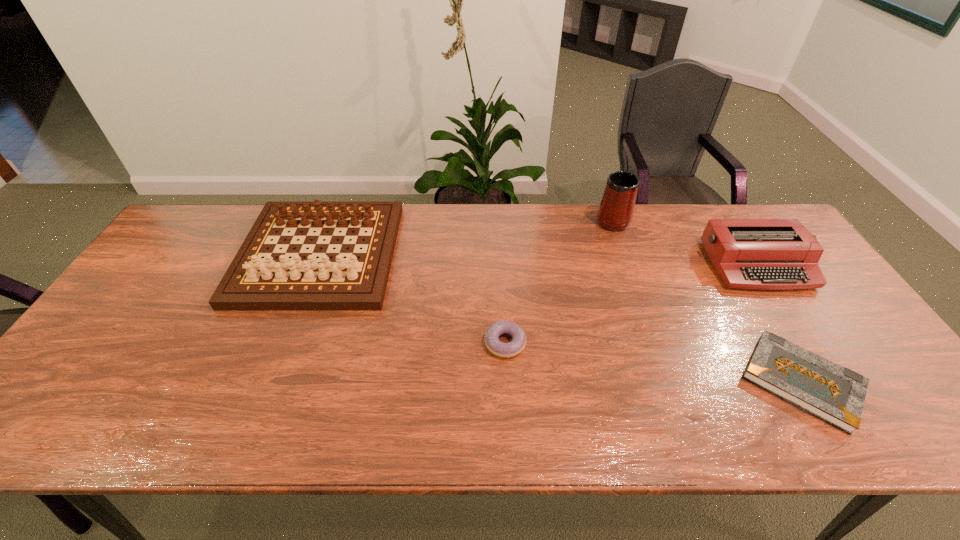
Where is `mug located at the far edge`? The image size is (960, 540). mug located at the far edge is located at coordinates (615, 212).

What are the coordinates of `gameboard present at the far edge` in the screenshot? It's located at (275, 282).

Find the location of a particular element. The image size is (960, 540). typewriter present at the far edge is located at coordinates (766, 254).

I want to click on object that is at the near edge, so pos(830,392).

I want to click on typewriter that is at the right edge, so click(x=766, y=254).

You are a GUI agent. You are given a task and a screenshot of the screen. Output one action in this format:
    pyautogui.click(x=<x>, y=<y>)
    Task: Click on the notebook that is at the right edge
    
    Given the screenshot: What is the action you would take?
    pyautogui.click(x=830, y=392)

Where is `object located at the far right corner`? The height and width of the screenshot is (540, 960). object located at the far right corner is located at coordinates (766, 254).

The height and width of the screenshot is (540, 960). What are the coordinates of `object located in the near right corner section of the desktop` in the screenshot? It's located at (830, 392).

Where is `free spot at the far edge of the desktop`? The height and width of the screenshot is (540, 960). free spot at the far edge of the desktop is located at coordinates (489, 206).

This screenshot has height=540, width=960. In the image, there is a desktop. In order to click on vacant space at the near edge in this screenshot , I will do `click(637, 421)`.